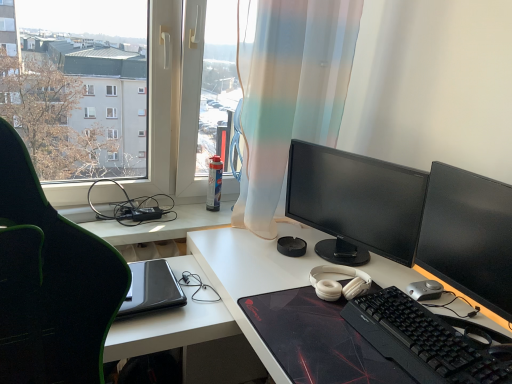
Find the location of a particular element. The width and height of the screenshot is (512, 384). empty space that is ontop of black matte keyboard at lower right (from a real-world perspective) is located at coordinates (433, 332).